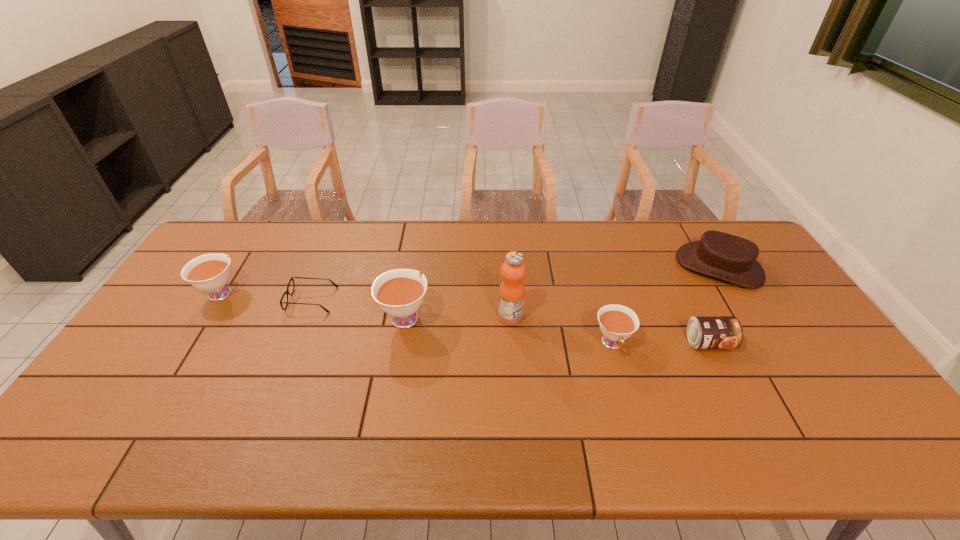
The teacups are evenly distributed in the image. To maintain this, where would you place another teacup on the right? Please point to a free space. Please provide its 2D coordinates. Your answer should be formatted as a tuple, i.e. [(x, y)], where the tuple contains the x and y coordinates of a point satisfying the conditions above.

[(847, 375)]